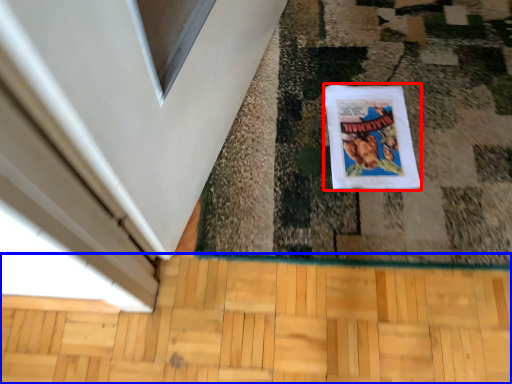
Question: Which point is closer to the camera, comic book (highlighted by a red box) or hardwood (highlighted by a blue box)?

Choices:
 (A) comic book
 (B) hardwood

Answer: (B)